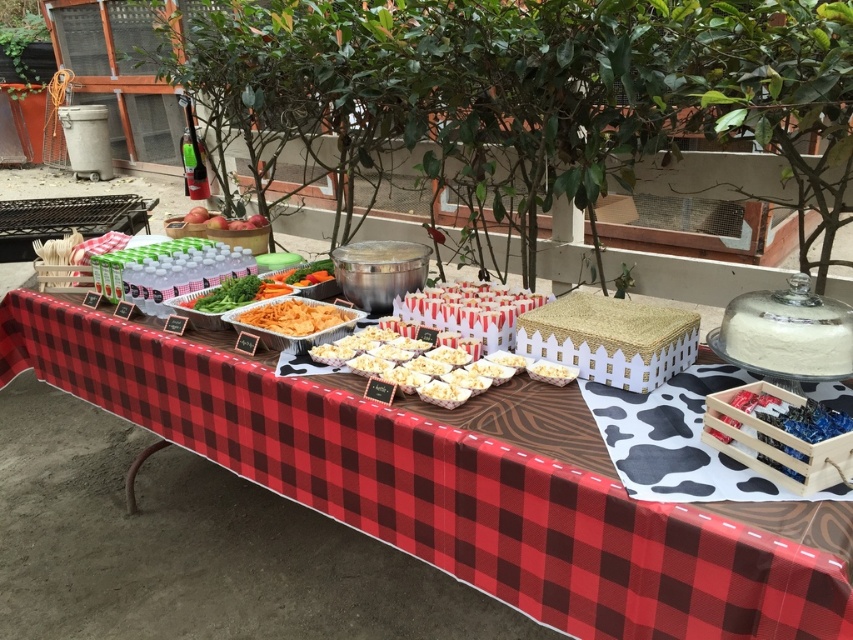
You are at the center of the table and want to reach the white paper cups at center. According to the coordinates given, are you directly in front of them or do you need to move left or right?

The white paper cups at center are located at coordinates point (468,305). Since you are at the center of the table, you are directly in front of them.

You are at the festive outdoor food setup and want to reach the point at coordinates point (198,305). However, there is an obstacle at point (260,305) in your way. Can you move around it to reach your destination?

Point (198,305) is behind point (260,305), so you can move around the obstacle at point (260,305) to reach your destination.

You are a guest at the event and want to grab a snack from the table. If you move forward towards the table, which object will you encounter first, the red plaid tablecloth at center or the white paper cups at center?

The white paper cups at center are closer to you, so you will encounter them first before reaching the red plaid tablecloth at center.